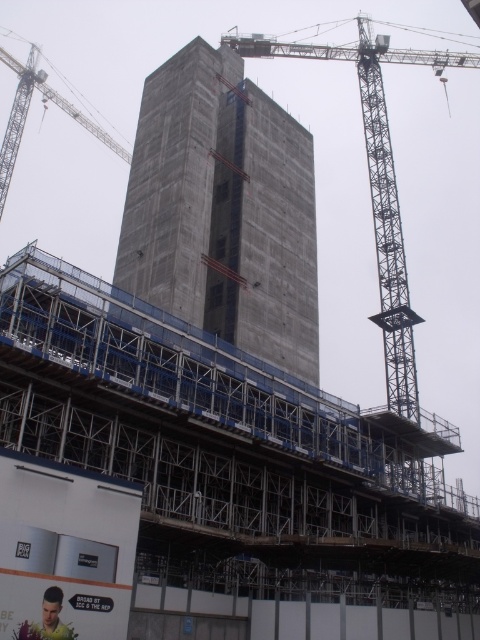
Consider the image. You are a construction worker who needs to transport materials from the metallic gray crane at upper left to the concrete scaffolding at center. Given that your vehicle can only travel in a straight line and has a maximum range of 250 feet, will you be able to reach the scaffolding from the crane?

The concrete scaffolding at center is 273.53 feet from the metallic gray crane at upper left. Since the vehicle has a maximum range of 250 feet, it cannot reach the scaffolding from the crane.

You are a construction worker standing at the yellow shirt at lower left. You need to lift a heavy beam to the top of the metallic gray crane at upper left. Can you reach the crane with the beam using the crane itself?

The metallic gray crane at upper left is taller than the yellow shirt at lower left, so yes, the crane can lift the beam to its top since it is higher than your current position at the yellow shirt at lower left.

You are an engineer inspecting a construction site. You see the concrete at center and the gray metallic crane at center. Which object is taller?

The gray metallic crane at center is taller than the concrete at center.